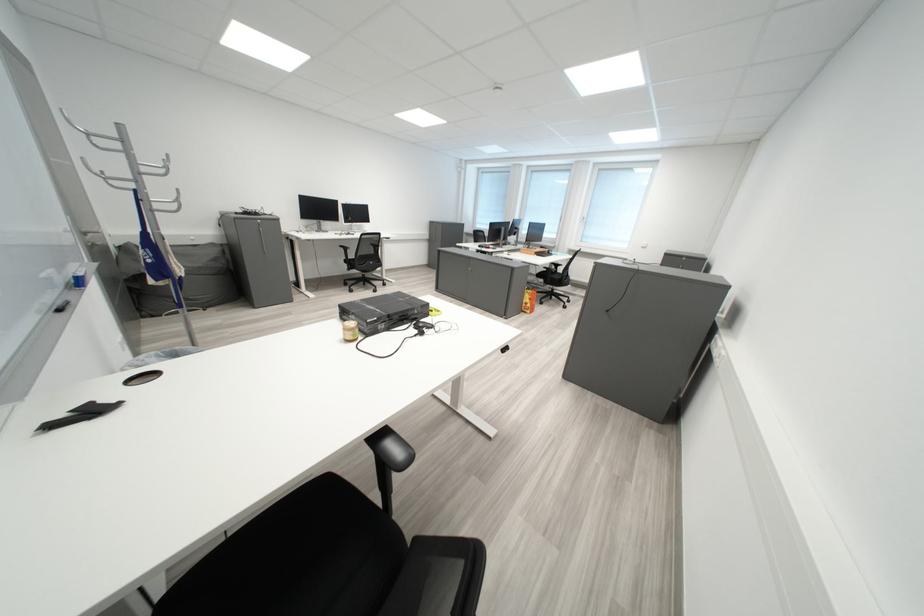
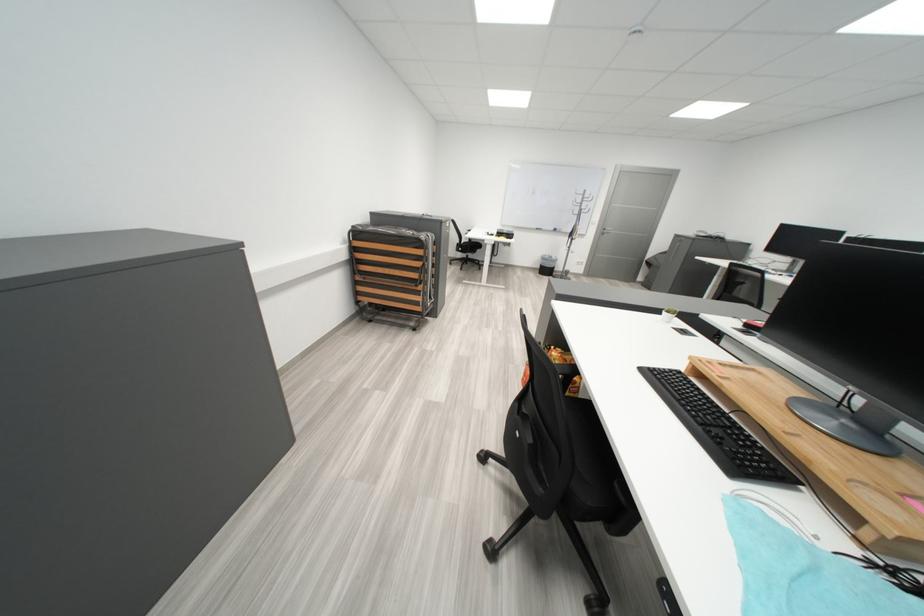
Question: I am providing you with two images of the same scene from different viewpoints. Please identify which objects are invisible in image2.

Choices:
 (A) white bowl
 (B) small yellow jar
 (C) black chair armrest
 (D) grey door handle

Answer: (B)